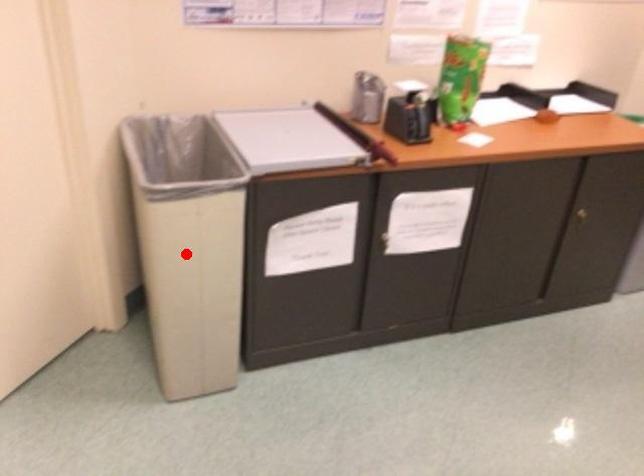
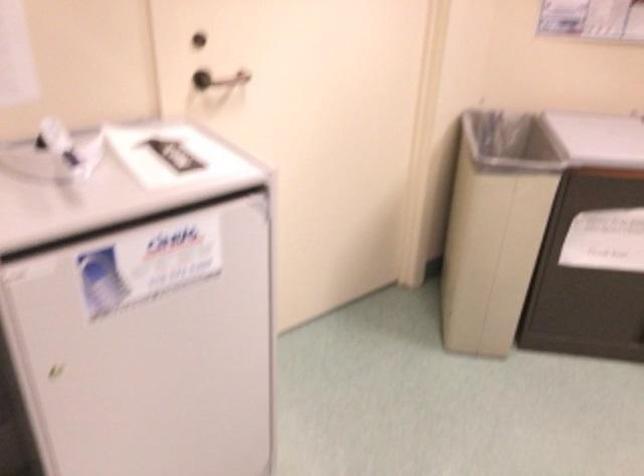
Question: I am providing you with two images of the same scene from different viewpoints. In image1, a red point is highlighted. Considering the same 3D point in image2, which of the following is correct?

Choices:
 (A) It is closer
 (B) It is farther

Answer: (B)